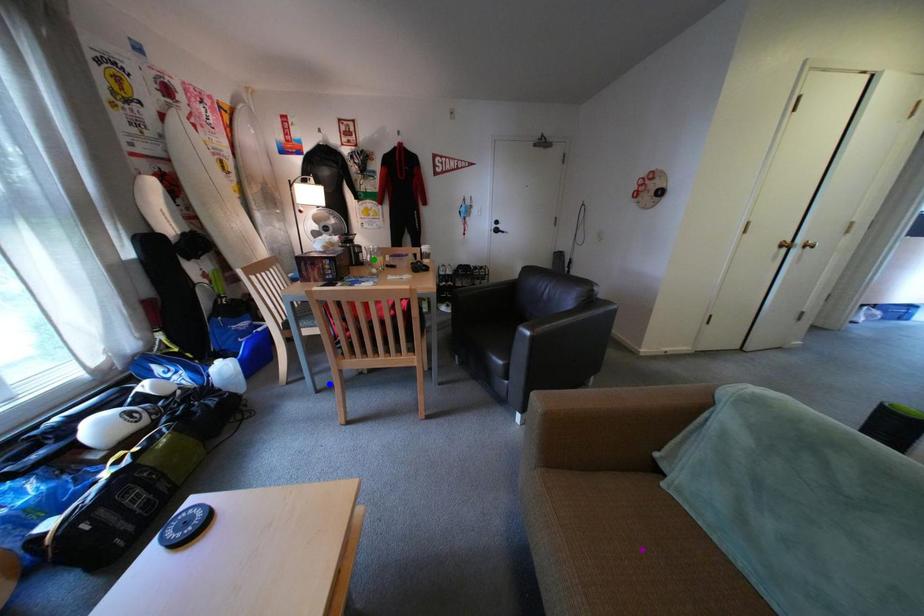
Looking at this image, order these from nearest to farthest:
green point | purple point | blue point

1. green point
2. blue point
3. purple point